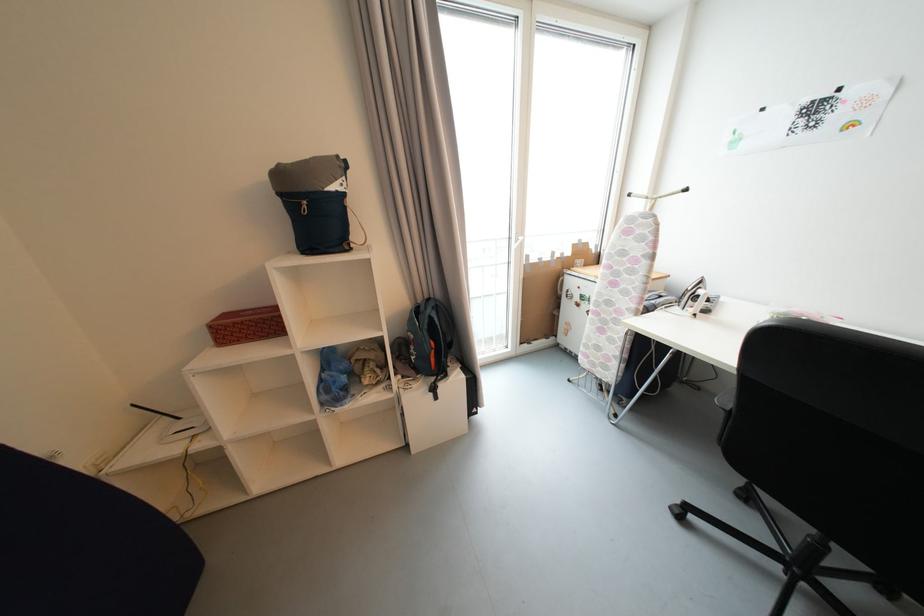
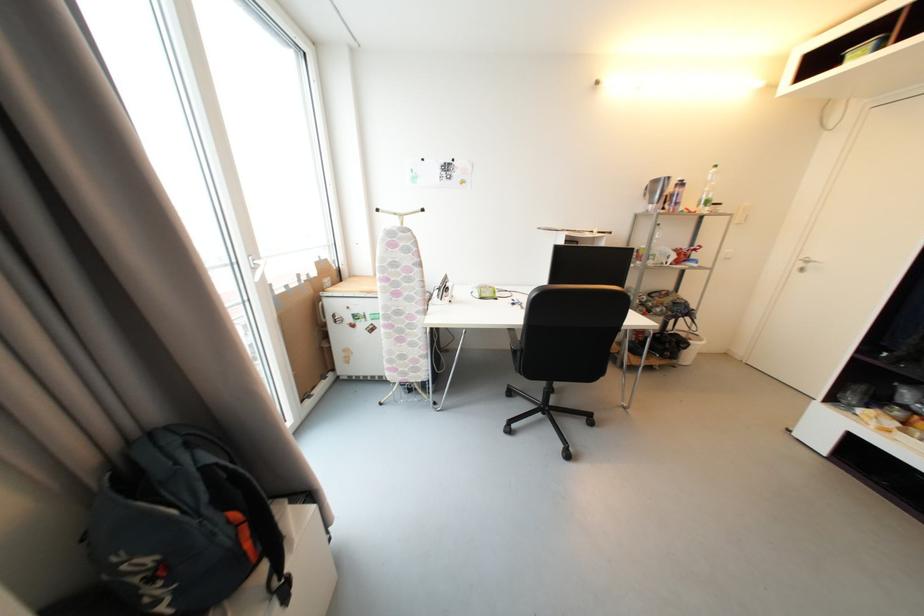
Question: How did the camera likely rotate?

Choices:
 (A) Left
 (B) Right
 (C) Up
 (D) Down

Answer: (B)